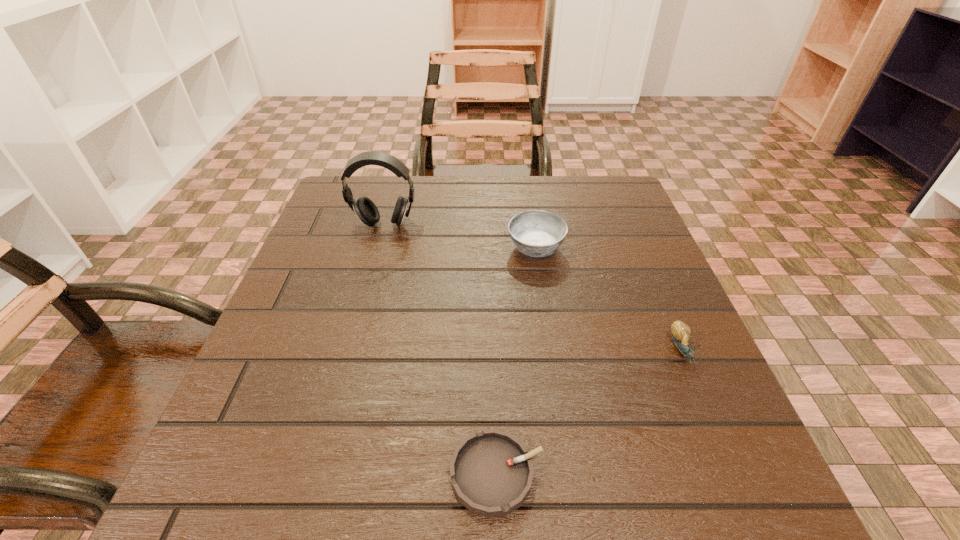
I want to click on the leftmost object, so click(363, 207).

This screenshot has width=960, height=540. In order to click on the tallest object in this screenshot , I will do pyautogui.click(x=363, y=207).

Find the location of a particular element. the second tallest object is located at coordinates (537, 233).

The image size is (960, 540). Identify the location of the farther ashtray. (537, 233).

Where is `the second shortest object`? This screenshot has height=540, width=960. the second shortest object is located at coordinates (681, 332).

The width and height of the screenshot is (960, 540). I want to click on escargot, so click(x=681, y=332).

Locate an element on the screen. This screenshot has width=960, height=540. the nearest object is located at coordinates (491, 471).

Where is `the shortest object`? the shortest object is located at coordinates (491, 471).

The width and height of the screenshot is (960, 540). Identify the location of vacant space located on the ear cups of the earphone. (346, 367).

Image resolution: width=960 pixels, height=540 pixels. I want to click on vacant space located on the front of the third shortest object, so click(546, 320).